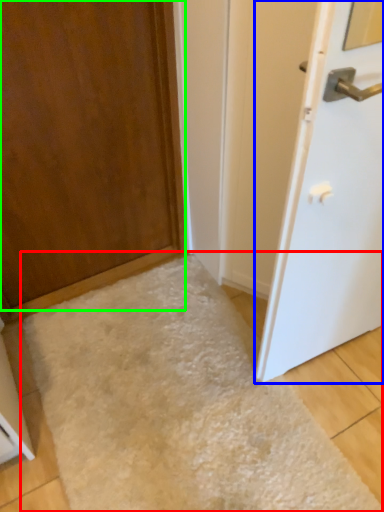
Question: Estimate the real-world distances between objects in this image. Which object is farther from flour (highlighted by a red box), door (highlighted by a blue box) or door (highlighted by a green box)?

Choices:
 (A) door
 (B) door

Answer: (B)